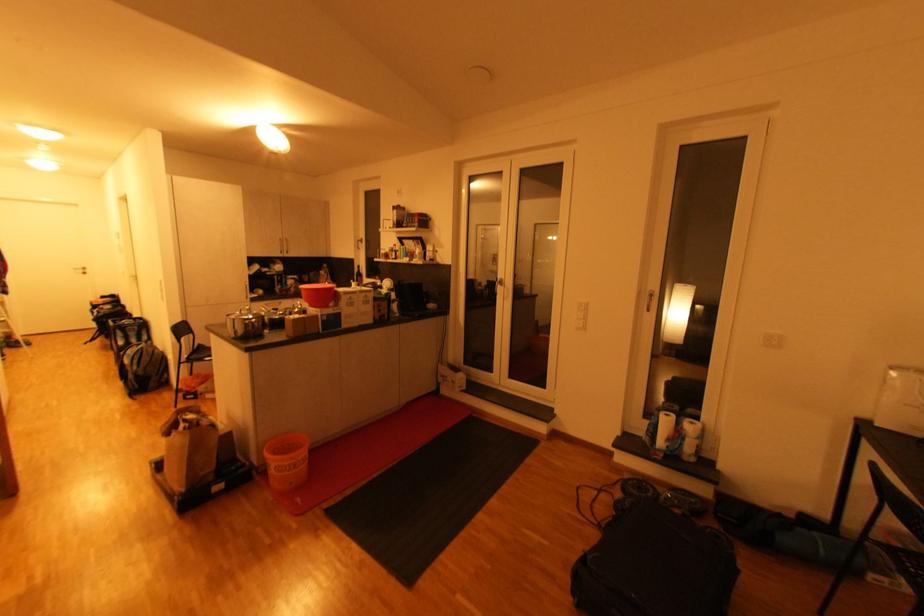
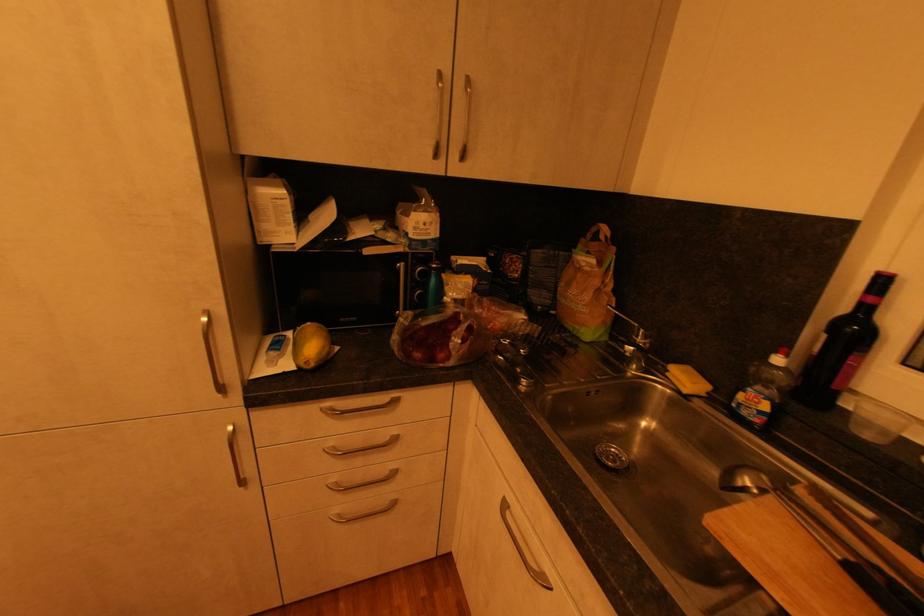
In the second image, find the point that corresponds to pixel 362 267 in the first image.

(889, 282)